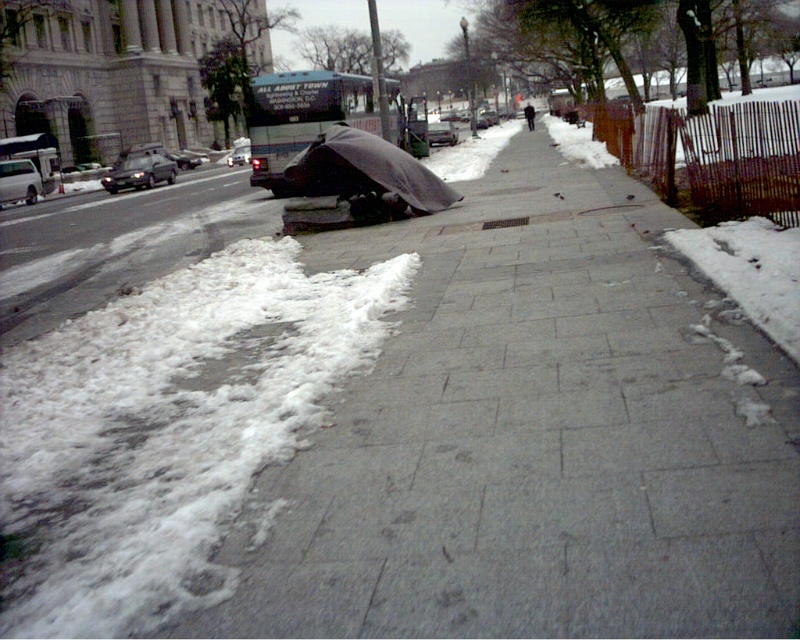
Question: In this image, where is dark gray tarp at center located relative to dark gray jacket at center?

Choices:
 (A) below
 (B) above

Answer: (A)

Question: Is gray concrete sidewalk at center to the left of shiny black sedan at left from the viewer's perspective?

Choices:
 (A) yes
 (B) no

Answer: (B)

Question: Where is gray concrete sidewalk at center located in relation to matte black car at center in the image?

Choices:
 (A) above
 (B) below

Answer: (B)

Question: Among these objects, which one is farthest from the camera?

Choices:
 (A) gray concrete sidewalk at center
 (B) shiny silver sedan at center
 (C) shiny black sedan at left
 (D) white powdery snow at lower left

Answer: (B)

Question: Which of these objects is positioned farthest from the dark gray jacket at center?

Choices:
 (A) shiny black sedan at left
 (B) dark gray tarp at center

Answer: (B)

Question: Which object is positioned closest to the gray concrete sidewalk at center?

Choices:
 (A) shiny black sedan at left
 (B) silver metallic sedan at left

Answer: (A)